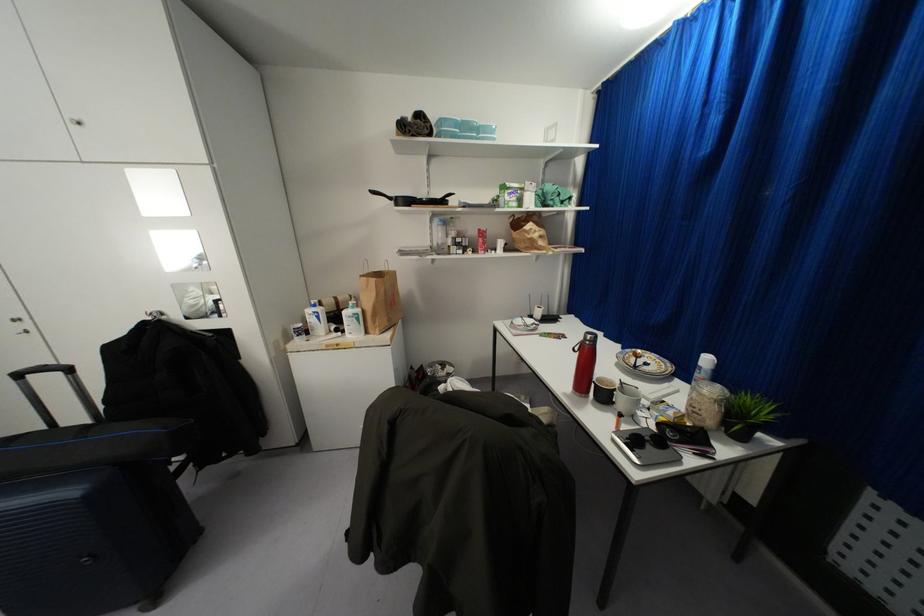
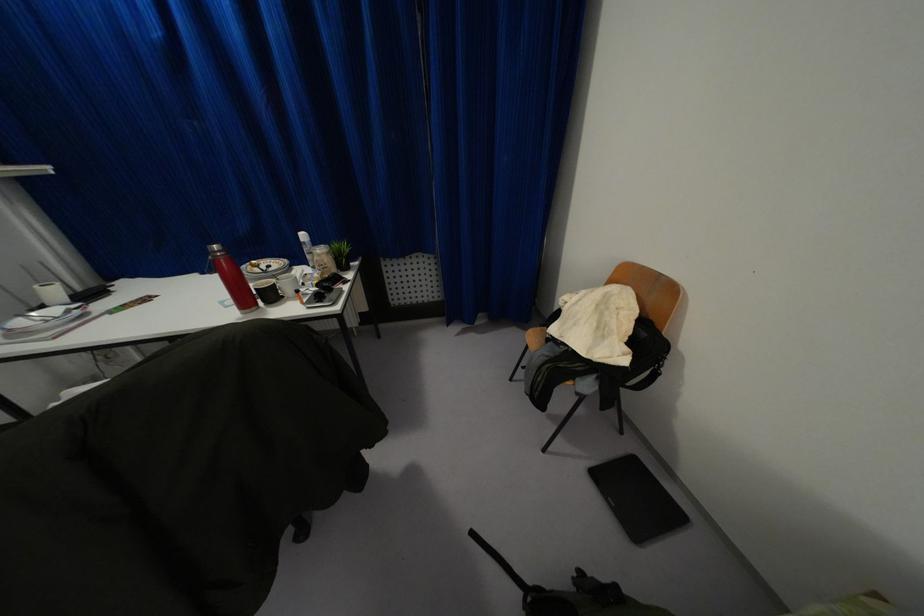
The point at (589, 336) is marked in the first image. Where is the corresponding point in the second image?

(214, 246)